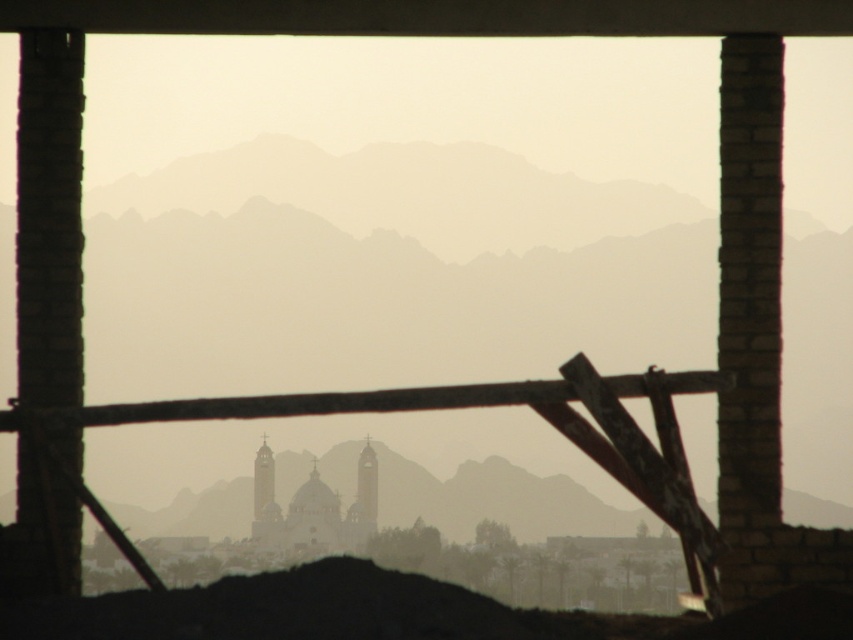
Looking at this image, who is positioned more to the right, brick at right or brown wooden beam at center?

brick at right is more to the right.

Does brick at right appear under brown wooden beam at center?

Incorrect, brick at right is not positioned below brown wooden beam at center.

Between point (741, 291) and point (680, 378), which one is positioned behind?

Point (741, 291)

You are a GUI agent. You are given a task and a screenshot of the screen. Output one action in this format:
    pyautogui.click(x=<x>, y=<y>)
    Task: Click on the brick at right
    Image resolution: width=853 pixels, height=640 pixels.
    Given the screenshot: What is the action you would take?
    pyautogui.click(x=749, y=312)

Which is above, brick at right or brick wall at left?

brick at right is higher up.

Is brick at right bigger than brick wall at left?

Yes, brick at right is bigger than brick wall at left.

This screenshot has width=853, height=640. Find the location of `brick at right`. brick at right is located at coordinates (749, 312).

At what (x,y) coordinates should I click in order to perform the action: click on brick at right. Please return your answer as a coordinate pair (x, y). This screenshot has height=640, width=853. Looking at the image, I should click on (749, 312).

Can you confirm if brick wall at left is positioned to the right of brown wooden beam at center?

No, brick wall at left is not to the right of brown wooden beam at center.

Who is more distant from viewer, [74,436] or [520,392]?

Positioned behind is point [74,436].

Is point (68, 108) farther from camera compared to point (15, 422)?

Yes, it is.

I want to click on brick wall at left, so click(49, 218).